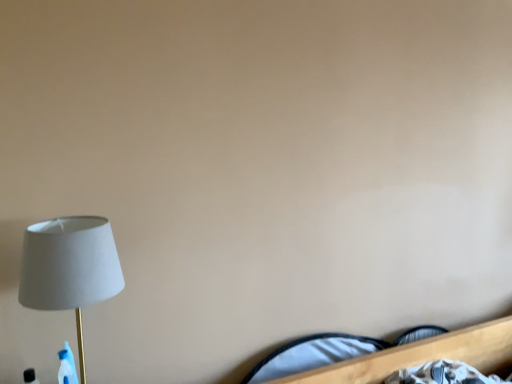
The image size is (512, 384). What do you see at coordinates (69, 267) in the screenshot?
I see `white fabric lamp at left` at bounding box center [69, 267].

In order to click on white fabric lamp at left in this screenshot , I will do `click(69, 267)`.

Find the location of a particular element. The width and height of the screenshot is (512, 384). white fabric bed at lower right is located at coordinates (421, 356).

The height and width of the screenshot is (384, 512). What do you see at coordinates (421, 356) in the screenshot?
I see `white fabric bed at lower right` at bounding box center [421, 356].

Identify the location of white fabric lamp at left. The width and height of the screenshot is (512, 384). (69, 267).

Considering the positions of objects white fabric bed at lower right and white fabric lamp at left in the image provided, who is more to the right, white fabric bed at lower right or white fabric lamp at left?

From the viewer's perspective, white fabric bed at lower right appears more on the right side.

Which is behind, white fabric bed at lower right or white fabric lamp at left?

white fabric bed at lower right is further away from the camera.

Is point (436, 349) positioned after point (49, 296)?

Yes, it is.

In the scene shown: From the image's perspective, is white fabric bed at lower right located beneath white fabric lamp at left?

Yes.

From a real-world perspective, which is physically below, white fabric bed at lower right or white fabric lamp at left?

white fabric bed at lower right.

Looking at this image, is white fabric bed at lower right wider than white fabric lamp at left?

No.

In the scene shown: Between white fabric bed at lower right and white fabric lamp at left, which one has more height?

Standing taller between the two is white fabric lamp at left.

Considering the relative sizes of white fabric bed at lower right and white fabric lamp at left in the image provided, is white fabric bed at lower right smaller than white fabric lamp at left?

Yes.

Is white fabric bed at lower right located outside white fabric lamp at left?

That's correct, white fabric bed at lower right is outside of white fabric lamp at left.

Is white fabric bed at lower right far away from white fabric lamp at left?

No, white fabric bed at lower right is in close proximity to white fabric lamp at left.

Consider the image. Is white fabric bed at lower right oriented towards white fabric lamp at left?

No, white fabric bed at lower right is not oriented towards white fabric lamp at left.

How different are the orientations of white fabric bed at lower right and white fabric lamp at left in degrees?

white fabric bed at lower right and white fabric lamp at left are facing 4.32 degrees away from each other.

How far apart are white fabric bed at lower right and white fabric lamp at left?

white fabric bed at lower right and white fabric lamp at left are 36.66 inches apart.

You are a GUI agent. You are given a task and a screenshot of the screen. Output one action in this format:
    pyautogui.click(x=<x>, y=<y>)
    Task: Click on the bed on the right of white fabric lamp at left
    The width and height of the screenshot is (512, 384).
    Given the screenshot: What is the action you would take?
    pyautogui.click(x=421, y=356)

Would you say white fabric lamp at left is to the left or to the right of white fabric bed at lower right in the picture?

From the image, it's evident that white fabric lamp at left is to the left of white fabric bed at lower right.

Is the position of white fabric lamp at left less distant than that of white fabric bed at lower right?

Yes, white fabric lamp at left is closer to the viewer.

Is point (79, 216) in front of point (325, 374)?

Yes, it is in front of point (325, 374).

From the image's perspective, would you say white fabric lamp at left is shown under white fabric bed at lower right?

No, from the image's perspective, white fabric lamp at left is not below white fabric bed at lower right.

From a real-world perspective, between white fabric lamp at left and white fabric bed at lower right, who is vertically lower?

In real-world perspective, white fabric bed at lower right is lower.

Is white fabric lamp at left wider than white fabric bed at lower right?

Correct, the width of white fabric lamp at left exceeds that of white fabric bed at lower right.

Does white fabric lamp at left have a lesser height compared to white fabric bed at lower right?

No, white fabric lamp at left is not shorter than white fabric bed at lower right.

Between white fabric lamp at left and white fabric bed at lower right, which one has smaller size?

white fabric bed at lower right is smaller.

Is white fabric lamp at left spatially inside white fabric bed at lower right, or outside of it?

white fabric lamp at left cannot be found inside white fabric bed at lower right.

Is white fabric lamp at left not close to white fabric bed at lower right?

That's not correct — white fabric lamp at left is a little close to white fabric bed at lower right.

Is white fabric lamp at left positioned with its back to white fabric bed at lower right?

No, white fabric lamp at left is not facing the opposite direction of white fabric bed at lower right.

At what (x,y) coordinates should I click in order to perform the action: click on bed below the white fabric lamp at left (from the image's perspective). Please return your answer as a coordinate pair (x, y). Looking at the image, I should click on 421,356.

Find the location of a particular element. This screenshot has height=384, width=512. lamp above the white fabric bed at lower right (from the image's perspective) is located at coordinates (69, 267).

Locate an element on the screen. The width and height of the screenshot is (512, 384). bed behind the white fabric lamp at left is located at coordinates (421, 356).